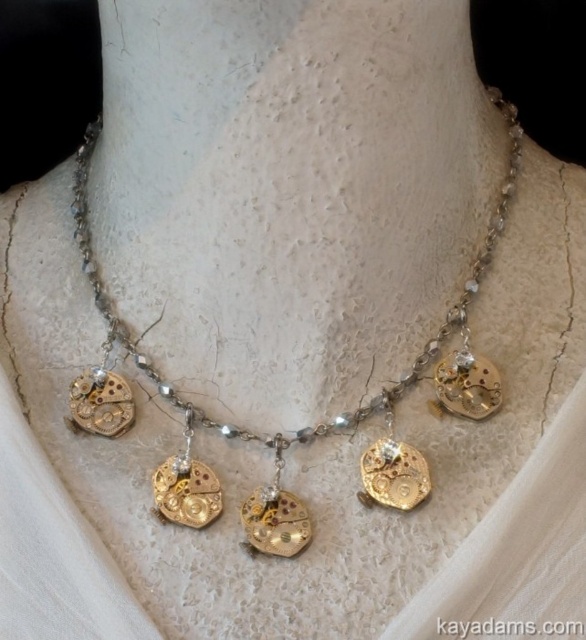
Question: Is gold metallic watch parts at center positioned at the back of gold metallic watch mechanism at center?

Choices:
 (A) no
 (B) yes

Answer: (A)

Question: Is gold metallic watch parts at center thinner than gold metallic watch mechanism at center?

Choices:
 (A) no
 (B) yes

Answer: (A)

Question: Can you confirm if gold metallic watch parts at center is thinner than gold metallic watch mechanism at center?

Choices:
 (A) no
 (B) yes

Answer: (A)

Question: Which of the following is the closest to the observer?

Choices:
 (A) gold metallic watch mechanism at center
 (B) gold metallic watch parts at center

Answer: (B)